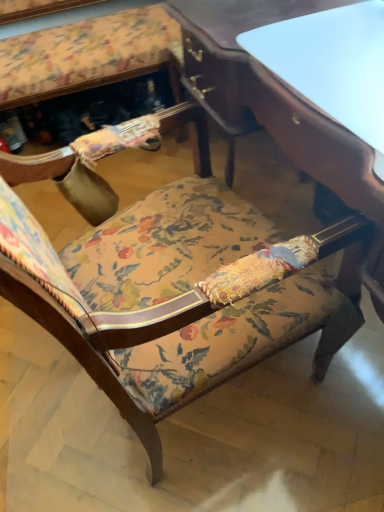
Describe the element at coordinates (165, 298) in the screenshot. I see `floral fabric chair at center` at that location.

The height and width of the screenshot is (512, 384). In order to click on floral fabric chair at center in this screenshot , I will do (165, 298).

Measure the distance between floral fabric chair at center and camera.

They are 16.27 inches apart.

Where is `floral fabric chair at center`? floral fabric chair at center is located at coordinates (x=165, y=298).